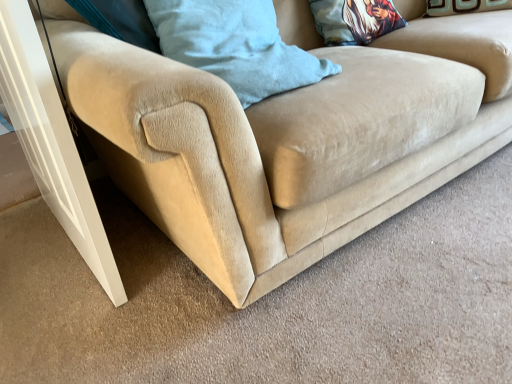
Find the location of a particular element. corduroy blue pillow at upper center, the second pillow from the back is located at coordinates (234, 45).

The image size is (512, 384). Identify the location of white glossy screen door at lower left. (51, 142).

Identify the location of corduroy blue pillow at upper center, which appears as the first pillow when viewed from the front. (234, 45).

Considering the positions of objects corduroy blue pillow at upper center, the second pillow from the back, and printed fabric pillow at upper center, acting as the 1th pillow starting from the back, in the image provided, who is more to the left, corduroy blue pillow at upper center, the second pillow from the back, or printed fabric pillow at upper center, acting as the 1th pillow starting from the back,?

corduroy blue pillow at upper center, the second pillow from the back, is more to the left.

Looking at this image, is corduroy blue pillow at upper center, the 2th pillow positioned from the right, looking in the opposite direction of printed fabric pillow at upper center, the 2th pillow when ordered from front to back?

corduroy blue pillow at upper center, the 2th pillow positioned from the right, is not turned away from printed fabric pillow at upper center, the 2th pillow when ordered from front to back.

From a real-world perspective, between corduroy blue pillow at upper center, the second pillow from the back, and printed fabric pillow at upper center, which appears as the first pillow when viewed from the right, who is vertically lower?

printed fabric pillow at upper center, which appears as the first pillow when viewed from the right, is physically lower.

From a real-world perspective, is printed fabric pillow at upper center, the 2th pillow when ordered from front to back, positioned above or below corduroy blue pillow at upper center, the second pillow from the back?

In terms of real-world spatial position, printed fabric pillow at upper center, the 2th pillow when ordered from front to back, is below corduroy blue pillow at upper center, the second pillow from the back.

Which of these two, printed fabric pillow at upper center, acting as the 1th pillow starting from the back, or corduroy blue pillow at upper center, the 2th pillow positioned from the right, is wider?

Wider between the two is corduroy blue pillow at upper center, the 2th pillow positioned from the right.

Can you confirm if printed fabric pillow at upper center, the 2th pillow when ordered from front to back, is shorter than corduroy blue pillow at upper center, marked as the 1th pillow in a left-to-right arrangement?

Yes.

Is printed fabric pillow at upper center, which appears as the first pillow when viewed from the right, to the left of corduroy blue pillow at upper center, which appears as the first pillow when viewed from the front, from the viewer's perspective?

Incorrect, printed fabric pillow at upper center, which appears as the first pillow when viewed from the right, is not on the left side of corduroy blue pillow at upper center, which appears as the first pillow when viewed from the front.

Considering the relative sizes of corduroy blue pillow at upper center, the second pillow from the back, and white glossy screen door at lower left in the image provided, is corduroy blue pillow at upper center, the second pillow from the back, wider than white glossy screen door at lower left?

Indeed, corduroy blue pillow at upper center, the second pillow from the back, has a greater width compared to white glossy screen door at lower left.

Is corduroy blue pillow at upper center, marked as the 1th pillow in a left-to-right arrangement, positioned with its back to white glossy screen door at lower left?

corduroy blue pillow at upper center, marked as the 1th pillow in a left-to-right arrangement, is not turned away from white glossy screen door at lower left.

The image size is (512, 384). In the image, there is a corduroy blue pillow at upper center, the second pillow from the back. What are the coordinates of `screen door below it (from a real-world perspective)` in the screenshot? It's located at (51, 142).

Looking at this image, is corduroy blue pillow at upper center, the second pillow from the back, far away from white glossy screen door at lower left?

No, there isn't a large distance between corduroy blue pillow at upper center, the second pillow from the back, and white glossy screen door at lower left.

Is printed fabric pillow at upper center, the 2th pillow when ordered from front to back, far from white glossy screen door at lower left?

Absolutely, printed fabric pillow at upper center, the 2th pillow when ordered from front to back, is distant from white glossy screen door at lower left.

Considering the positions of objects printed fabric pillow at upper center, the 2th pillow when ordered from front to back, and white glossy screen door at lower left in the image provided, who is more to the right, printed fabric pillow at upper center, the 2th pillow when ordered from front to back, or white glossy screen door at lower left?

printed fabric pillow at upper center, the 2th pillow when ordered from front to back.

Who is smaller, printed fabric pillow at upper center, the 2th pillow when ordered from front to back, or white glossy screen door at lower left?

printed fabric pillow at upper center, the 2th pillow when ordered from front to back, is smaller.

Considering the relative positions of white glossy screen door at lower left and corduroy blue pillow at upper center, the second pillow from the back, in the image provided, is white glossy screen door at lower left to the right of corduroy blue pillow at upper center, the second pillow from the back, from the viewer's perspective?

Incorrect, white glossy screen door at lower left is not on the right side of corduroy blue pillow at upper center, the second pillow from the back.

Consider the image. Which is less distant, (x=54, y=171) or (x=218, y=51)?

Point (x=54, y=171) is positioned farther from the camera compared to point (x=218, y=51).

Which of these two, white glossy screen door at lower left or corduroy blue pillow at upper center, marked as the 1th pillow in a left-to-right arrangement, is thinner?

Thinner between the two is white glossy screen door at lower left.

Considering the relative sizes of white glossy screen door at lower left and printed fabric pillow at upper center, arranged as the second pillow when viewed from the left, in the image provided, is white glossy screen door at lower left wider than printed fabric pillow at upper center, arranged as the second pillow when viewed from the left,?

In fact, white glossy screen door at lower left might be narrower than printed fabric pillow at upper center, arranged as the second pillow when viewed from the left.

Considering the positions of objects white glossy screen door at lower left and printed fabric pillow at upper center, which appears as the first pillow when viewed from the right, in the image provided, who is more to the left, white glossy screen door at lower left or printed fabric pillow at upper center, which appears as the first pillow when viewed from the right,?

white glossy screen door at lower left is more to the left.

Starting from the white glossy screen door at lower left, which pillow is the 2nd one behind? Please provide its 2D coordinates.

[(354, 20)]

Locate an element on the screen. pillow lying behind the corduroy blue pillow at upper center, the 2th pillow positioned from the right is located at coordinates (354, 20).

The height and width of the screenshot is (384, 512). What are the coordinates of `pillow below the corduroy blue pillow at upper center, which appears as the first pillow when viewed from the front (from a real-world perspective)` in the screenshot? It's located at (354, 20).

When comparing their distances from white glossy screen door at lower left, does corduroy blue pillow at upper center, the 2th pillow positioned from the right, or printed fabric pillow at upper center, arranged as the second pillow when viewed from the left, seem closer?

Based on the image, corduroy blue pillow at upper center, the 2th pillow positioned from the right, appears to be nearer to white glossy screen door at lower left.

Looking at the image, which one is located further to corduroy blue pillow at upper center, which appears as the first pillow when viewed from the front, white glossy screen door at lower left or printed fabric pillow at upper center, acting as the 1th pillow starting from the back?

printed fabric pillow at upper center, acting as the 1th pillow starting from the back, is positioned further to the anchor corduroy blue pillow at upper center, which appears as the first pillow when viewed from the front.

Looking at the image, which one is located closer to printed fabric pillow at upper center, the 2th pillow when ordered from front to back, white glossy screen door at lower left or corduroy blue pillow at upper center, the second pillow from the back?

The object closer to printed fabric pillow at upper center, the 2th pillow when ordered from front to back, is corduroy blue pillow at upper center, the second pillow from the back.

Looking at the image, which one is located further to printed fabric pillow at upper center, which appears as the first pillow when viewed from the right, corduroy blue pillow at upper center, which appears as the first pillow when viewed from the front, or white glossy screen door at lower left?

white glossy screen door at lower left lies further to printed fabric pillow at upper center, which appears as the first pillow when viewed from the right, than the other object.

Which object lies nearer to the anchor point white glossy screen door at lower left, printed fabric pillow at upper center, acting as the 1th pillow starting from the back, or corduroy blue pillow at upper center, the second pillow from the back?

corduroy blue pillow at upper center, the second pillow from the back, lies closer to white glossy screen door at lower left than the other object.

Looking at this image, looking at the image, which one is located closer to corduroy blue pillow at upper center, the second pillow from the back, printed fabric pillow at upper center, which appears as the first pillow when viewed from the right, or white glossy screen door at lower left?

white glossy screen door at lower left is closer to corduroy blue pillow at upper center, the second pillow from the back.

I want to click on pillow between white glossy screen door at lower left and printed fabric pillow at upper center, which appears as the first pillow when viewed from the right, in the horizontal direction, so click(x=234, y=45).